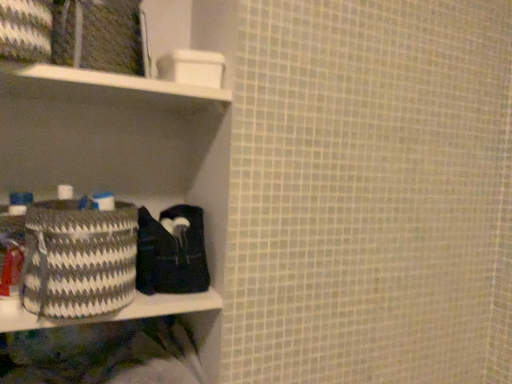
Question: Considering the positions of point (139, 213) and point (35, 314), is point (139, 213) closer or farther from the camera than point (35, 314)?

Choices:
 (A) farther
 (B) closer

Answer: (A)

Question: From a real-world perspective, is black fabric at lower left above or below textured woven basket at lower left?

Choices:
 (A) below
 (B) above

Answer: (B)

Question: Estimate the real-world distances between objects in this image. Which object is farther from the white plastic shelf at upper left?

Choices:
 (A) textured woven basket at lower left
 (B) black fabric at lower left
 (C) white and gray woven basket at left

Answer: (A)

Question: Which of these objects is positioned farthest from the textured woven basket at lower left?

Choices:
 (A) white plastic shelf at upper left
 (B) black fabric at lower left
 (C) white and gray woven basket at left

Answer: (A)